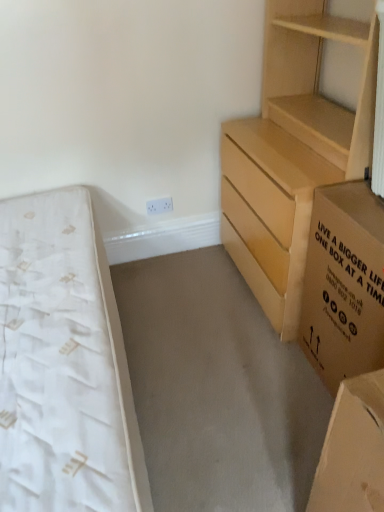
Question: Is white textured mattress at left further to the viewer compared to brown cardboard box at right?

Choices:
 (A) yes
 (B) no

Answer: (B)

Question: From the image's perspective, is white textured mattress at left below brown cardboard box at right?

Choices:
 (A) no
 (B) yes

Answer: (B)

Question: Would you say white textured mattress at left is outside brown cardboard box at right?

Choices:
 (A) yes
 (B) no

Answer: (A)

Question: Is white textured mattress at left smaller than brown cardboard box at right?

Choices:
 (A) yes
 (B) no

Answer: (B)

Question: Would you say white textured mattress at left is a long distance from brown cardboard box at right?

Choices:
 (A) no
 (B) yes

Answer: (A)

Question: Does white textured mattress at left have a lesser width compared to brown cardboard box at right?

Choices:
 (A) no
 (B) yes

Answer: (A)

Question: From a real-world perspective, is light brown wooden chest of drawers at right located higher than brown cardboard box at right?

Choices:
 (A) yes
 (B) no

Answer: (A)

Question: Considering the relative sizes of light brown wooden chest of drawers at right and brown cardboard box at right in the image provided, is light brown wooden chest of drawers at right shorter than brown cardboard box at right?

Choices:
 (A) no
 (B) yes

Answer: (A)

Question: Is light brown wooden chest of drawers at right oriented away from brown cardboard box at right?

Choices:
 (A) no
 (B) yes

Answer: (A)

Question: From a real-world perspective, does light brown wooden chest of drawers at right sit lower than brown cardboard box at right?

Choices:
 (A) no
 (B) yes

Answer: (A)

Question: Does light brown wooden chest of drawers at right have a greater height compared to brown cardboard box at right?

Choices:
 (A) yes
 (B) no

Answer: (A)

Question: Is light brown wooden chest of drawers at right bigger than brown cardboard box at right?

Choices:
 (A) yes
 (B) no

Answer: (A)

Question: From the image's perspective, does light brown wooden chest of drawers at right appear lower than white textured mattress at left?

Choices:
 (A) yes
 (B) no

Answer: (B)